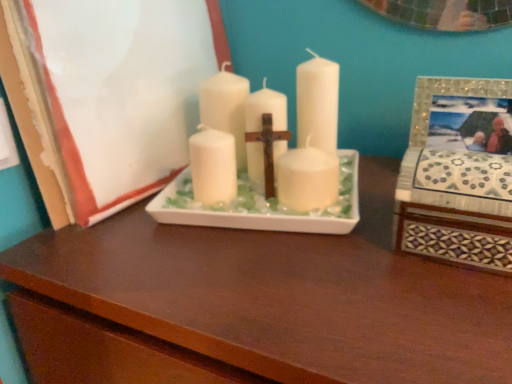
The height and width of the screenshot is (384, 512). Identify the location of free space that is in between mosaic tile picture frame at right, placed as the first picture frame when sorted from right to left, and white matte candle at center. (357, 231).